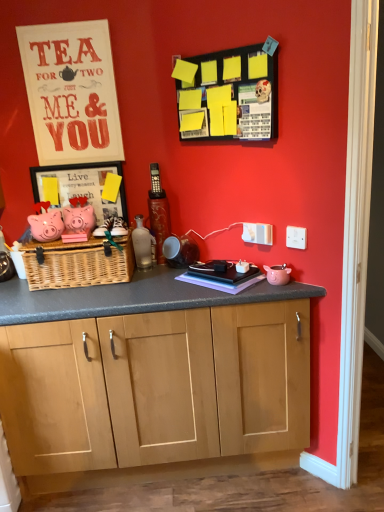
Identify the location of vacant region above yellow paper at upper center (from a real-world perspective). click(x=233, y=38).